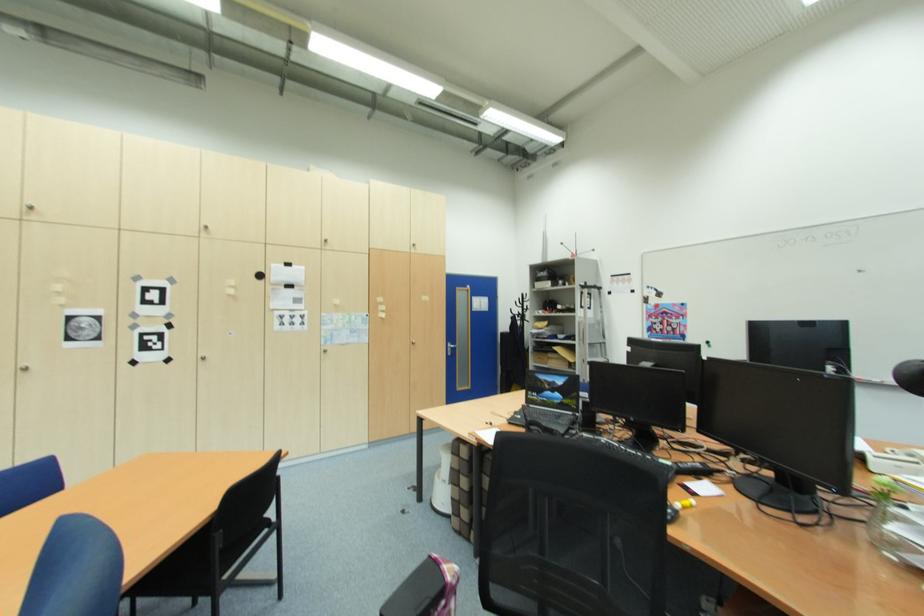
Find where to turn the blue door handle. Please return your answer as a coordinate pair (x, y).

(450, 349)